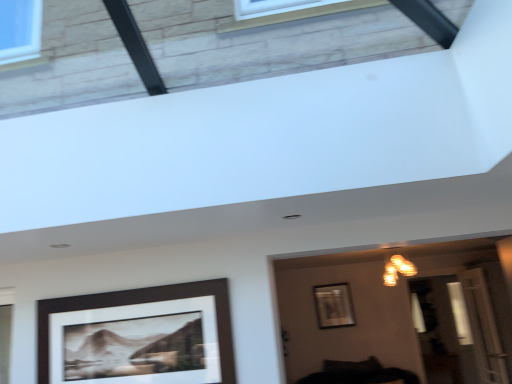
What are the coordinates of `black matte picture frame at lower left, marked as the 2th picture frame in a right-to-left arrangement` in the screenshot? It's located at (138, 336).

What is the approximate width of transparent glass door at lower right?

transparent glass door at lower right is 7.62 inches in width.

The width and height of the screenshot is (512, 384). What are the coordinates of `warm matte light fixture at upper center` in the screenshot? It's located at (397, 269).

From the image's perspective, is warm matte light fixture at upper center above transparent glass door at lower right?

Correct, warm matte light fixture at upper center appears higher than transparent glass door at lower right in the image.

Looking at this image, considering their positions, is warm matte light fixture at upper center located in front of or behind transparent glass door at lower right?

Visually, warm matte light fixture at upper center is located in front of transparent glass door at lower right.

Is warm matte light fixture at upper center positioned far away from transparent glass door at lower right?

warm matte light fixture at upper center is actually quite close to transparent glass door at lower right.

Does warm matte light fixture at upper center have a greater width compared to transparent glass door at lower right?

Yes, warm matte light fixture at upper center is wider than transparent glass door at lower right.

Is black matte picture frame at lower left, placed as the second picture frame when sorted from bottom to top, completely or partially inside metallic silver picture frame at center, which is the 1th picture frame in bottom-to-top order?

No, black matte picture frame at lower left, placed as the second picture frame when sorted from bottom to top, is located outside of metallic silver picture frame at center, which is the 1th picture frame in bottom-to-top order.

From the image's perspective, relative to black matte picture frame at lower left, the 2th picture frame from the back, is metallic silver picture frame at center, which is the 1th picture frame in bottom-to-top order, above or below?

metallic silver picture frame at center, which is the 1th picture frame in bottom-to-top order, is situated lower than black matte picture frame at lower left, the 2th picture frame from the back, in the image.

From a real-world perspective, is metallic silver picture frame at center, which is the 1th picture frame in bottom-to-top order, above or below black matte picture frame at lower left, placed as the second picture frame when sorted from bottom to top?

Clearly, from a real-world perspective, metallic silver picture frame at center, which is the 1th picture frame in bottom-to-top order, is above black matte picture frame at lower left, placed as the second picture frame when sorted from bottom to top.

Can you confirm if metallic silver picture frame at center, placed as the second picture frame when sorted from top to bottom, is smaller than black matte picture frame at lower left, placed as the second picture frame when sorted from bottom to top?

Correct, metallic silver picture frame at center, placed as the second picture frame when sorted from top to bottom, occupies less space than black matte picture frame at lower left, placed as the second picture frame when sorted from bottom to top.

Looking at their sizes, would you say metallic silver picture frame at center, the first picture frame from the right, is wider or thinner than transparent glass door at lower right?

metallic silver picture frame at center, the first picture frame from the right, is thinner than transparent glass door at lower right.

Which object is positioned more to the right, metallic silver picture frame at center, the second picture frame positioned from the left, or transparent glass door at lower right?

transparent glass door at lower right.

From a real-world perspective, relative to transparent glass door at lower right, is metallic silver picture frame at center, placed as the first picture frame when sorted from back to front, vertically above or below?

In terms of real-world spatial position, metallic silver picture frame at center, placed as the first picture frame when sorted from back to front, is above transparent glass door at lower right.

Considering the sizes of metallic silver picture frame at center, the first picture frame from the right, and transparent glass door at lower right in the image, is metallic silver picture frame at center, the first picture frame from the right, bigger or smaller than transparent glass door at lower right?

Considering their sizes, metallic silver picture frame at center, the first picture frame from the right, takes up less space than transparent glass door at lower right.

Does transparent glass door at lower right have a greater height compared to black matte picture frame at lower left, the 1th picture frame positioned from the top?

Yes, transparent glass door at lower right is taller than black matte picture frame at lower left, the 1th picture frame positioned from the top.

Where is `glass door behind the black matte picture frame at lower left, marked as the 2th picture frame in a right-to-left arrangement`? glass door behind the black matte picture frame at lower left, marked as the 2th picture frame in a right-to-left arrangement is located at coordinates (466, 325).

From a real-world perspective, is metallic silver picture frame at center, placed as the second picture frame when sorted from top to bottom, physically located above or below warm matte light fixture at upper center?

In terms of real-world spatial position, metallic silver picture frame at center, placed as the second picture frame when sorted from top to bottom, is below warm matte light fixture at upper center.

Which picture frame is the 1st one when counting from the left side of the warm matte light fixture at upper center? Please provide its 2D coordinates.

[(334, 305)]

Can you confirm if metallic silver picture frame at center, placed as the second picture frame when sorted from top to bottom, is wider than warm matte light fixture at upper center?

Incorrect, the width of metallic silver picture frame at center, placed as the second picture frame when sorted from top to bottom, does not surpass that of warm matte light fixture at upper center.

Based on their positions, is metallic silver picture frame at center, placed as the first picture frame when sorted from back to front, located to the left or right of warm matte light fixture at upper center?

metallic silver picture frame at center, placed as the first picture frame when sorted from back to front, is to the left of warm matte light fixture at upper center.

Looking at the image, does black matte picture frame at lower left, acting as the first picture frame starting from the front, seem bigger or smaller compared to metallic silver picture frame at center, which is the 1th picture frame in bottom-to-top order?

In the image, black matte picture frame at lower left, acting as the first picture frame starting from the front, appears to be larger than metallic silver picture frame at center, which is the 1th picture frame in bottom-to-top order.

In the scene shown: Is the surface of black matte picture frame at lower left, placed as the first picture frame when sorted from left to right, in direct contact with metallic silver picture frame at center, the second picture frame positioned from the left?

No, black matte picture frame at lower left, placed as the first picture frame when sorted from left to right, is not in contact with metallic silver picture frame at center, the second picture frame positioned from the left.

Which of these two, black matte picture frame at lower left, acting as the first picture frame starting from the front, or metallic silver picture frame at center, which appears as the 2th picture frame when viewed from the front, is wider?

Wider between the two is metallic silver picture frame at center, which appears as the 2th picture frame when viewed from the front.

Is black matte picture frame at lower left, the 2th picture frame from the back, completely or partially outside of metallic silver picture frame at center, the second picture frame positioned from the left?

Absolutely, black matte picture frame at lower left, the 2th picture frame from the back, is external to metallic silver picture frame at center, the second picture frame positioned from the left.

In the scene shown: Is warm matte light fixture at upper center taller than black matte picture frame at lower left, placed as the second picture frame when sorted from bottom to top?

No.

In the scene shown: From a real-world perspective, is warm matte light fixture at upper center on top of black matte picture frame at lower left, acting as the first picture frame starting from the front?

Indeed, from a real-world perspective, warm matte light fixture at upper center stands above black matte picture frame at lower left, acting as the first picture frame starting from the front.

Which is more to the left, warm matte light fixture at upper center or black matte picture frame at lower left, the 1th picture frame positioned from the top?

From the viewer's perspective, black matte picture frame at lower left, the 1th picture frame positioned from the top, appears more on the left side.

Is warm matte light fixture at upper center behind black matte picture frame at lower left, the 1th picture frame positioned from the top?

That is True.

Locate an element on the screen. This screenshot has height=384, width=512. glass door below the warm matte light fixture at upper center (from a real-world perspective) is located at coordinates (466, 325).

The image size is (512, 384). In order to click on picture frame that is above the black matte picture frame at lower left, placed as the second picture frame when sorted from bottom to top (from a real-world perspective) in this screenshot , I will do click(x=334, y=305).

From the image, which object appears to be nearer to transparent glass door at lower right, black matte picture frame at lower left, the 2th picture frame from the back, or metallic silver picture frame at center, which is the 1th picture frame in bottom-to-top order?

metallic silver picture frame at center, which is the 1th picture frame in bottom-to-top order, lies closer to transparent glass door at lower right than the other object.

Considering their positions, is transparent glass door at lower right positioned further to warm matte light fixture at upper center than black matte picture frame at lower left, acting as the first picture frame starting from the front?

black matte picture frame at lower left, acting as the first picture frame starting from the front.

Based on the photo, based on their spatial positions, is black matte picture frame at lower left, marked as the 2th picture frame in a right-to-left arrangement, or transparent glass door at lower right closer to warm matte light fixture at upper center?

transparent glass door at lower right is positioned closer to the anchor warm matte light fixture at upper center.

Based on their spatial positions, is black matte picture frame at lower left, the 2th picture frame from the back, or metallic silver picture frame at center, placed as the second picture frame when sorted from top to bottom, closer to warm matte light fixture at upper center?

The object closer to warm matte light fixture at upper center is metallic silver picture frame at center, placed as the second picture frame when sorted from top to bottom.

From the image, which object appears to be farther from transparent glass door at lower right, metallic silver picture frame at center, the second picture frame positioned from the left, or black matte picture frame at lower left, the 2th picture frame from the back?

black matte picture frame at lower left, the 2th picture frame from the back, lies further to transparent glass door at lower right than the other object.

Considering their positions, is transparent glass door at lower right positioned closer to black matte picture frame at lower left, the 2th picture frame from the back, than warm matte light fixture at upper center?

warm matte light fixture at upper center.

Estimate the real-world distances between objects in this image. Which object is further from metallic silver picture frame at center, which appears as the 2th picture frame when viewed from the front, transparent glass door at lower right or warm matte light fixture at upper center?

transparent glass door at lower right.

When comparing their distances from transparent glass door at lower right, does warm matte light fixture at upper center or metallic silver picture frame at center, which appears as the 2th picture frame when viewed from the front, seem closer?

Among the two, warm matte light fixture at upper center is located nearer to transparent glass door at lower right.

I want to click on light fixture between black matte picture frame at lower left, placed as the second picture frame when sorted from bottom to top, and metallic silver picture frame at center, the first picture frame from the right, along the z-axis, so click(x=397, y=269).

I want to click on glass door between black matte picture frame at lower left, the 1th picture frame positioned from the top, and metallic silver picture frame at center, which is the 1th picture frame in bottom-to-top order, from front to back, so click(466, 325).

The width and height of the screenshot is (512, 384). In order to click on glass door located between warm matte light fixture at upper center and metallic silver picture frame at center, placed as the second picture frame when sorted from top to bottom, in the depth direction in this screenshot , I will do `click(466, 325)`.

I want to click on light fixture situated between black matte picture frame at lower left, the 2th picture frame from the back, and transparent glass door at lower right from left to right, so click(397, 269).